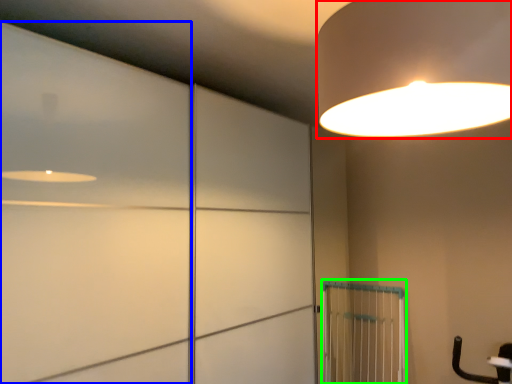
Question: Estimate the real-world distances between objects in this image. Which object is closer to lamp (highlighted by a red box), door (highlighted by a blue box) or cage (highlighted by a green box)?

Choices:
 (A) door
 (B) cage

Answer: (A)